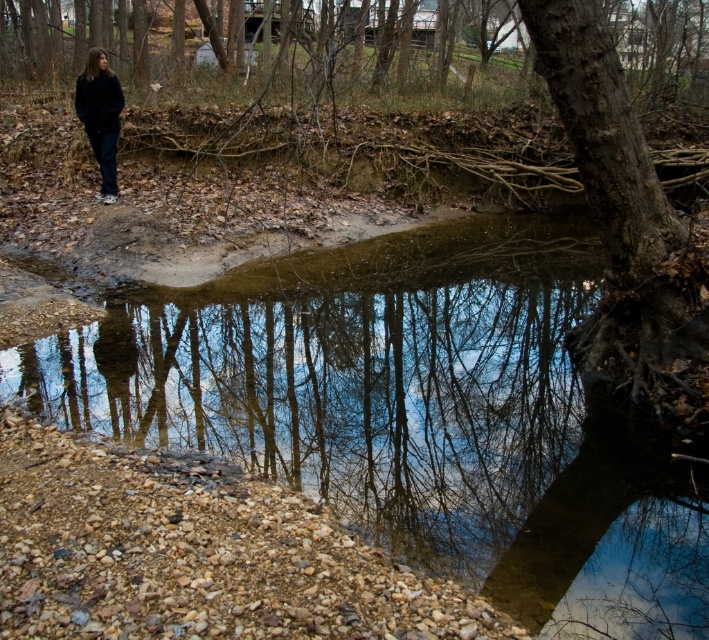
Does clear water at center have a greater height compared to dark blue jeans at left?

No.

Between point (372, 412) and point (106, 179), which one is positioned behind?

The point (106, 179) is behind.

Where is `clear water at center`? clear water at center is located at coordinates (413, 412).

In order to click on clear water at center in this screenshot , I will do `click(413, 412)`.